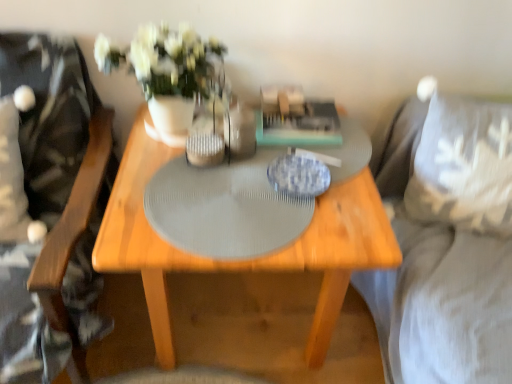
Question: From a real-world perspective, is white ceramic vase at center positioned above or below gray textured placemat at center?

Choices:
 (A) below
 (B) above

Answer: (B)

Question: In the image, is white ceramic vase at center positioned in front of or behind gray textured placemat at center?

Choices:
 (A) front
 (B) behind

Answer: (B)

Question: Based on their relative distances, which object is nearer to the white ceramic vase at center?

Choices:
 (A) wooden swivel chair at left
 (B) wooden table at center
 (C) gray textured placemat at center
 (D) suede gray couch at right
 (E) white fabric pillow at right

Answer: (C)

Question: Which object is positioned closest to the wooden table at center?

Choices:
 (A) suede gray couch at right
 (B) white fabric pillow at right
 (C) wooden swivel chair at left
 (D) white ceramic vase at center
 (E) gray textured placemat at center

Answer: (E)